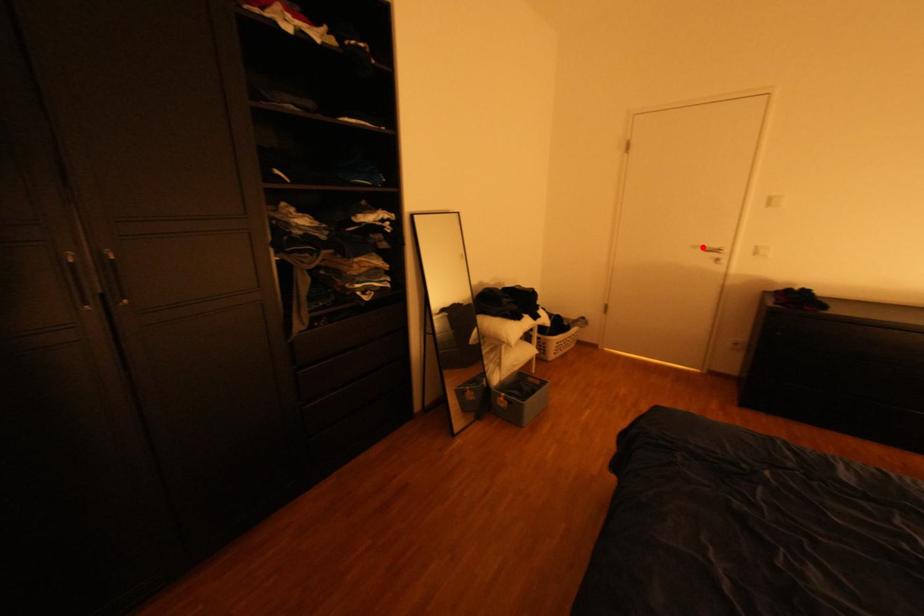
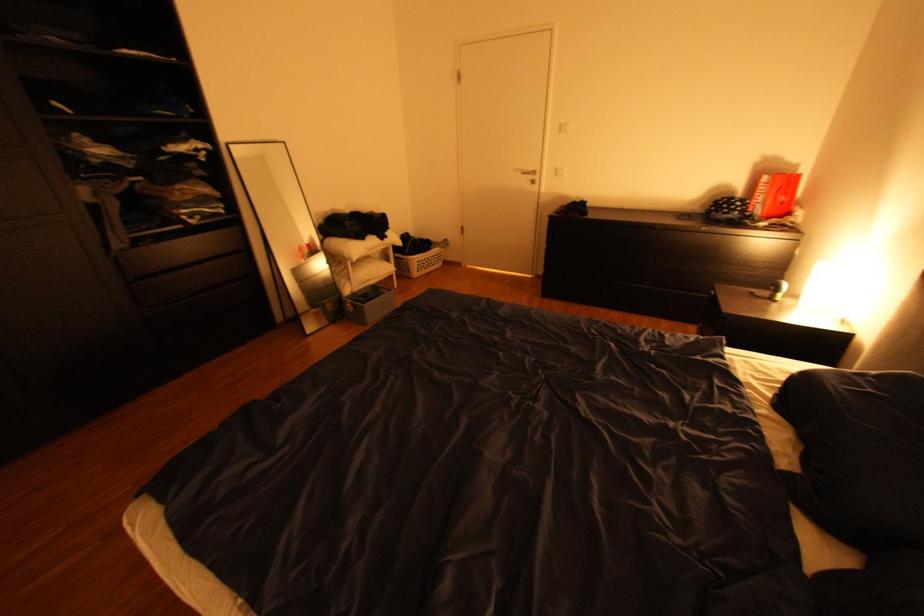
Question: A red point is marked in image1. In image2, is the corresponding 3D point closer to the camera or farther? Reply with the corresponding letter.

Choices:
 (A) The corresponding 3D point is closer.
 (B) The corresponding 3D point is farther.

Answer: (A)